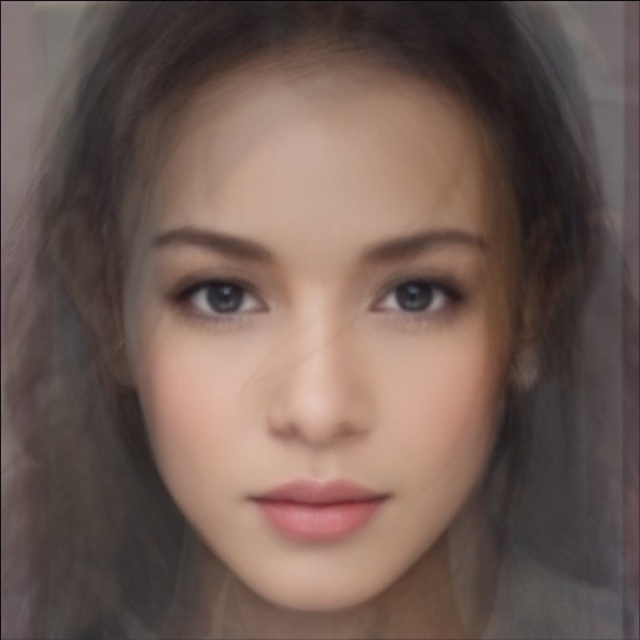
Which of these two, smooth skin face at center or blue glossy eye at center, stands shorter?

Standing shorter between the two is blue glossy eye at center.

Is point (189, 257) farther from viewer compared to point (200, 307)?

No, it is in front of (200, 307).

This screenshot has height=640, width=640. What are the coordinates of `smooth skin face at center` in the screenshot? It's located at (321, 324).

Which is in front, point (397, 248) or point (262, 248)?

Point (262, 248) is in front.

Who is positioned more to the right, brown smooth eyebrow at upper center or brown smooth eyebrow at center?

Positioned to the right is brown smooth eyebrow at upper center.

This screenshot has height=640, width=640. What do you see at coordinates (422, 243) in the screenshot?
I see `brown smooth eyebrow at upper center` at bounding box center [422, 243].

Identify the location of brown smooth eyebrow at upper center. Image resolution: width=640 pixels, height=640 pixels. (422, 243).

Who is positioned more to the right, blue glossy eye at center or brown smooth eyebrow at center?

From the viewer's perspective, blue glossy eye at center appears more on the right side.

Can you confirm if blue glossy eye at center is shorter than brown smooth eyebrow at center?

Incorrect, blue glossy eye at center's height does not fall short of brown smooth eyebrow at center's.

Find the location of a particular element. blue glossy eye at center is located at coordinates (220, 300).